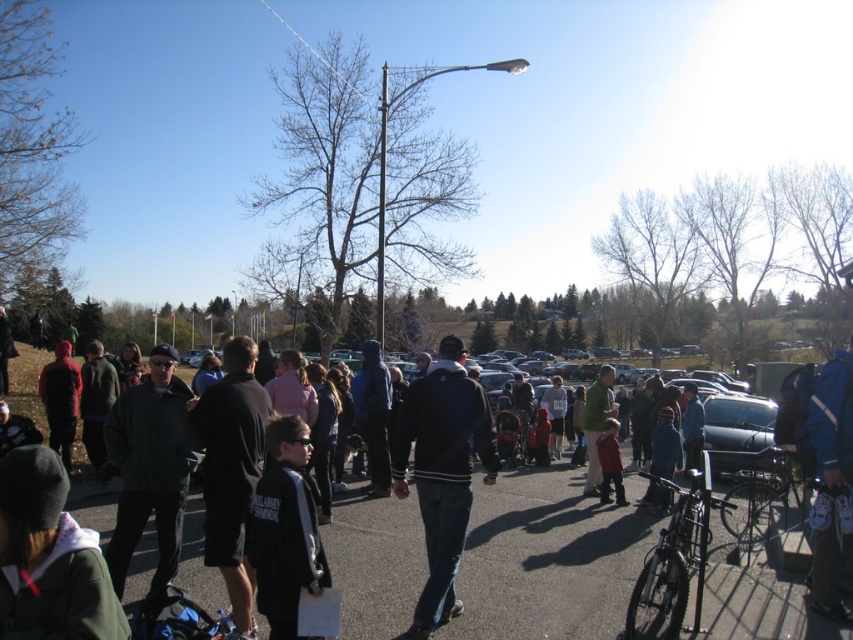
You are a photographer at the event and want to capture both the black fleece jacket at center and the black cotton jacket at center in the same photo. Which jacket will appear lower in the final photo?

The black fleece jacket at center will appear lower in the final photo because it is positioned below the black cotton jacket at center.

You are a photographer trying to capture a photo of the shiny black bike at lower right without including the black cotton jacket at center in the frame. Based on their positions, is this possible?

The black cotton jacket at center is to the left of the shiny black bike at lower right, so if you position yourself to the right side of the bike or adjust your angle to exclude the jacket, it should be possible to capture the bike without the jacket in the frame.

Consider the image. You are a photographer trying to capture a group photo of the two jackets, dark green jacket at center and black cotton jacket at center. The camera you are using has a minimum focus distance of 30 inches. Can you take the photo without moving either jacket?

The dark green jacket at center and black cotton jacket at center are 29.83 inches apart from each other, which is less than the camera minimum focus distance of 30 inches. Therefore, you cannot take the photo without moving either jacket.